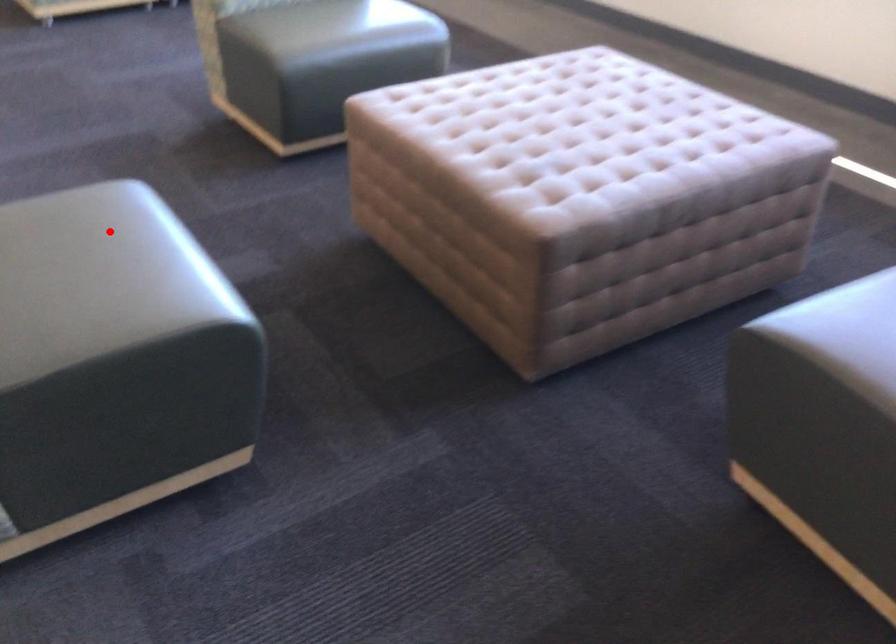
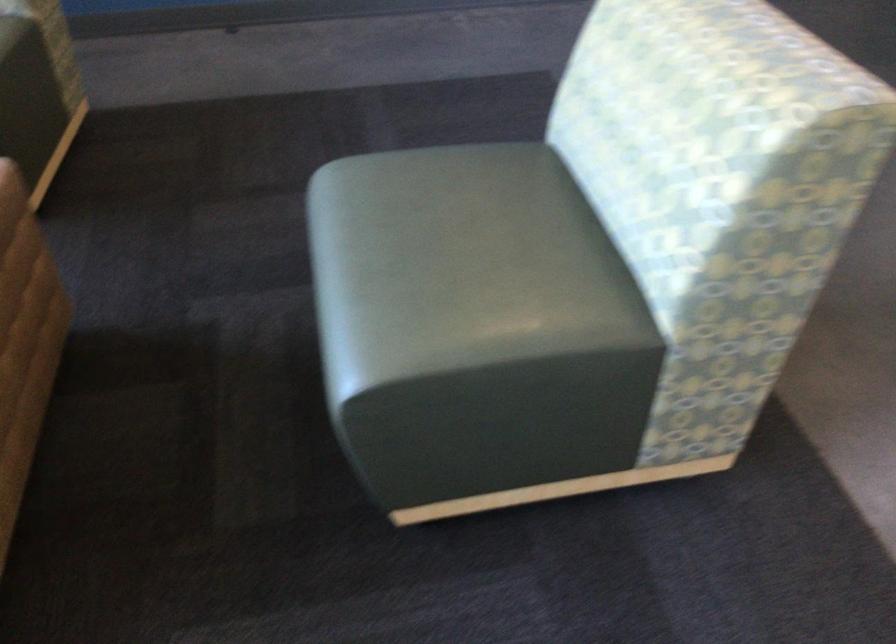
In the second image, find the point that corresponds to the highlighted location in the first image.

(460, 265)